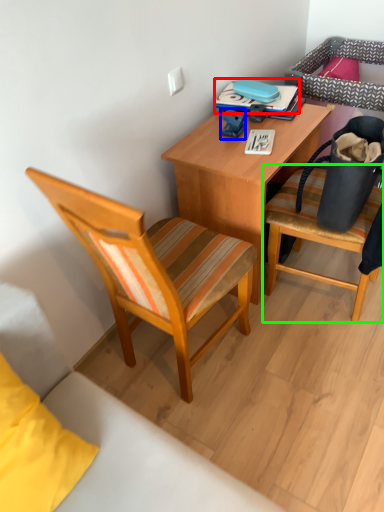
Question: Estimate the real-world distances between objects in this image. Which object is closer to book (highlighted by a red box), toy (highlighted by a blue box) or chair (highlighted by a green box)?

Choices:
 (A) toy
 (B) chair

Answer: (A)